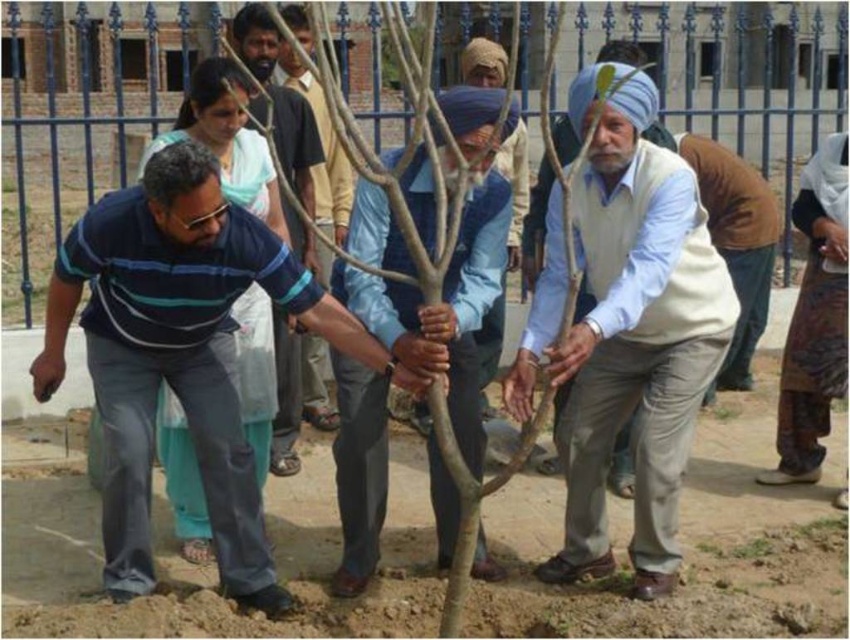
Which of these two, light beige cotton shirt at center or light blue fabric shirt at center, stands taller?

light beige cotton shirt at center is taller.

At what (x,y) coordinates should I click in order to perform the action: click on light beige cotton shirt at center. Please return your answer as a coordinate pair (x, y). Looking at the image, I should click on [x=627, y=337].

Between point (604, 564) and point (357, 186), which one is positioned in front?

Point (604, 564) is in front.

Where is `light beige cotton shirt at center`? The height and width of the screenshot is (640, 850). light beige cotton shirt at center is located at coordinates (627, 337).

Does light beige cotton shirt at center have a lesser height compared to matte blue shirt at center?

Indeed, light beige cotton shirt at center has a lesser height compared to matte blue shirt at center.

In the scene shown: Who is positioned more to the right, light beige cotton shirt at center or matte blue shirt at center?

light beige cotton shirt at center is more to the right.

Who is more forward, (658, 230) or (337, 160)?

Point (658, 230)

Find the location of a particular element. light beige cotton shirt at center is located at coordinates (627, 337).

Is blue striped shirt at center to the right of matte blue shirt at center from the viewer's perspective?

No, blue striped shirt at center is not to the right of matte blue shirt at center.

Between point (275, 420) and point (313, 86), which one is positioned behind?

Positioned behind is point (313, 86).

Find the location of a particular element. The height and width of the screenshot is (640, 850). blue striped shirt at center is located at coordinates (279, 100).